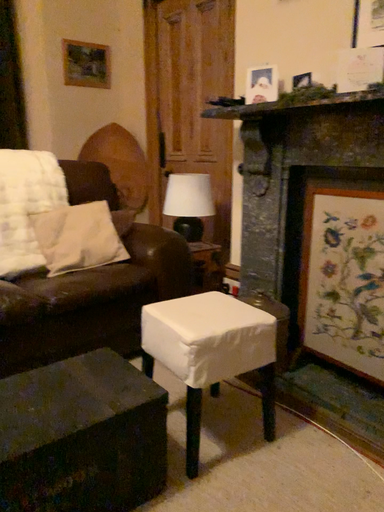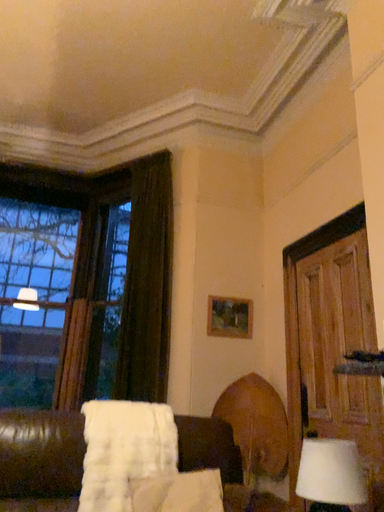
Question: Which way did the camera rotate in the video?

Choices:
 (A) rotated upward
 (B) rotated downward

Answer: (A)